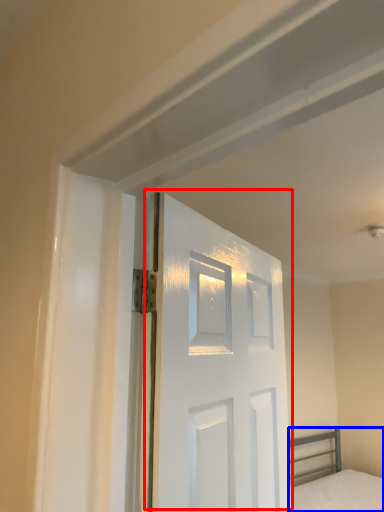
Question: Among these objects, which one is farthest to the camera, door (highlighted by a red box) or bed (highlighted by a blue box)?

Choices:
 (A) door
 (B) bed

Answer: (B)